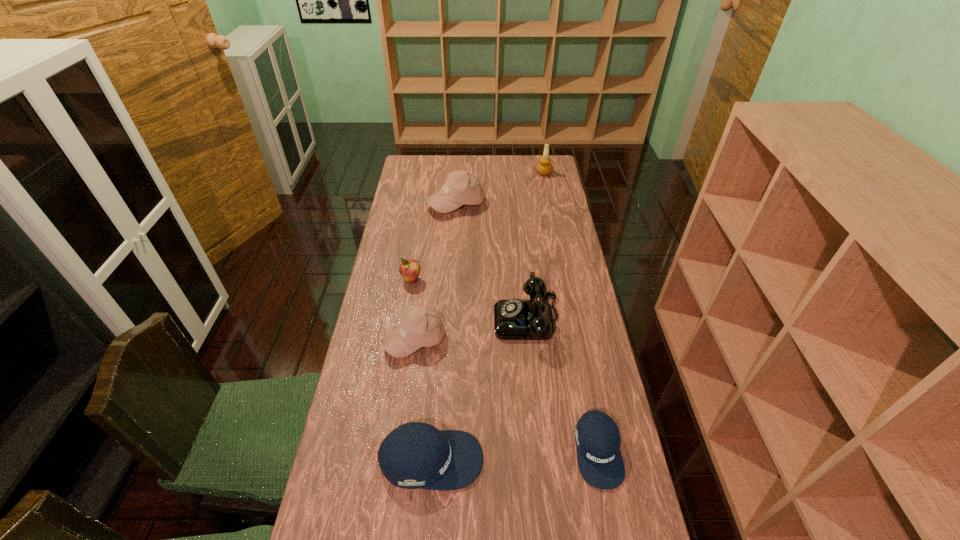
At what (x,y) coordinates should I click in order to perform the action: click on vacant space that satisfies the following two spatial constraints: 1. on the front side of the farthest object; 2. on the dial of the black telephone. Please return your answer as a coordinate pair (x, y). This screenshot has height=540, width=960. Looking at the image, I should click on (x=573, y=319).